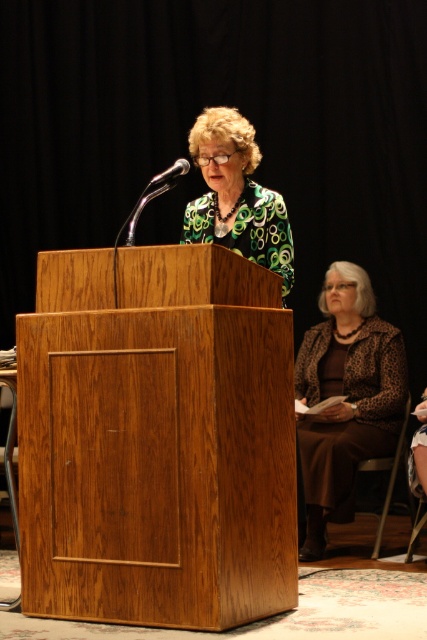
Question: Can you confirm if wooden podium at center is smaller than metallic silver microphone at upper left?

Choices:
 (A) no
 (B) yes

Answer: (A)

Question: Which object is the farthest from the wooden podium at center?

Choices:
 (A) metallic silver microphone at upper left
 (B) brown fabric chair at lower right
 (C) green patterned blouse at center

Answer: (B)

Question: Which point appears farthest from the camera in this image?

Choices:
 (A) (380, 524)
 (B) (157, 449)
 (C) (231, 141)

Answer: (A)

Question: Does green patterned blouse at center come in front of metallic silver microphone at upper left?

Choices:
 (A) yes
 (B) no

Answer: (B)

Question: Is leopard print jacket at lower right to the right of brown fabric chair at lower right from the viewer's perspective?

Choices:
 (A) no
 (B) yes

Answer: (A)

Question: Which point appears closest to the camera in this image?

Choices:
 (A) (377, 404)
 (B) (23, 515)
 (C) (173, 177)
 (D) (371, 467)

Answer: (B)